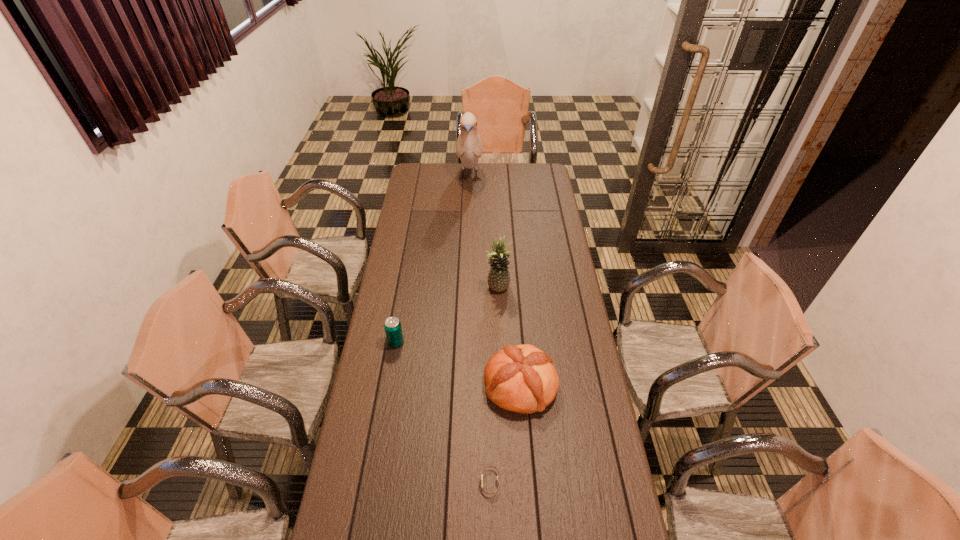
I want to click on the farthest object, so 469,146.

Find the location of a particular element. The image size is (960, 540). the tallest object is located at coordinates (469, 146).

At what (x,y) coordinates should I click in order to perform the action: click on the second farthest object. Please return your answer as a coordinate pair (x, y). This screenshot has height=540, width=960. Looking at the image, I should click on (499, 277).

Find the location of a particular element. The height and width of the screenshot is (540, 960). pineapple is located at coordinates (499, 277).

You are a GUI agent. You are given a task and a screenshot of the screen. Output one action in this format:
    pyautogui.click(x=<x>, y=<y>)
    Task: Click on the bread
    The image size is (960, 540).
    Given the screenshot: What is the action you would take?
    pyautogui.click(x=522, y=378)

I want to click on the third farthest object, so click(393, 329).

Where is `the leftmost object`? the leftmost object is located at coordinates (393, 329).

Locate an element on the screen. watch is located at coordinates (495, 492).

This screenshot has height=540, width=960. I want to click on the nearest object, so click(x=495, y=492).

What are the coordinates of `vacant space situated on the face of the parakeet` in the screenshot? It's located at (468, 208).